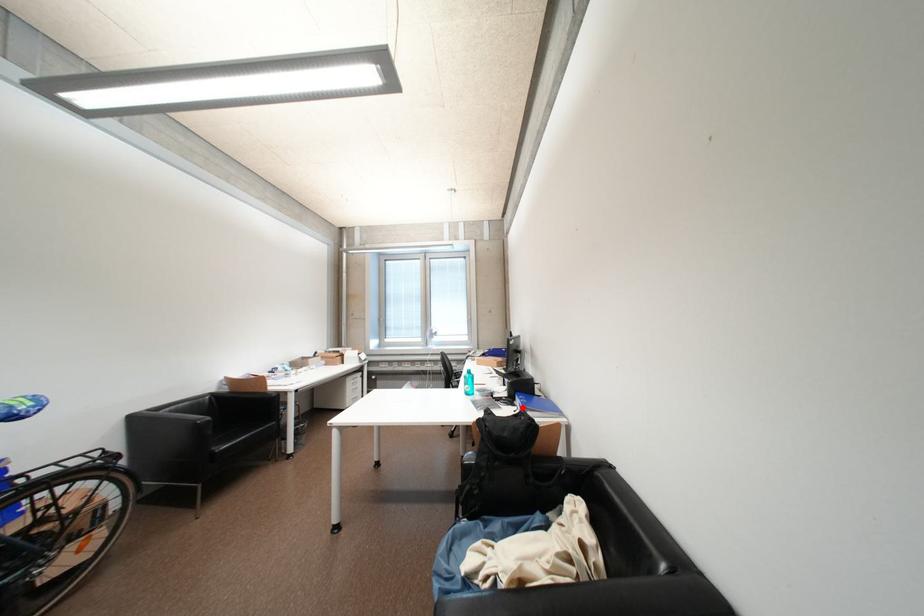
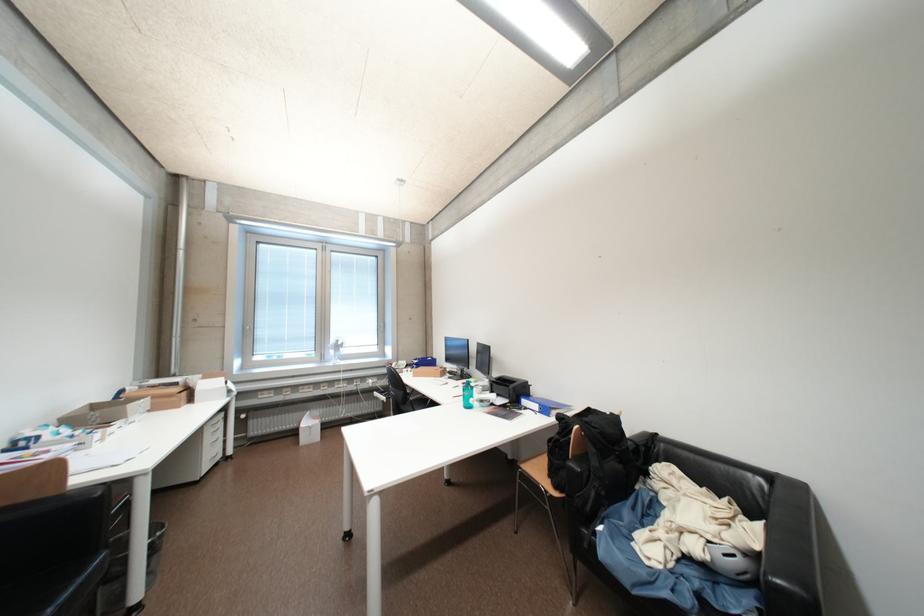
Locate, in the second image, the point that corresponds to the highlighted location in the first image.

(533, 411)